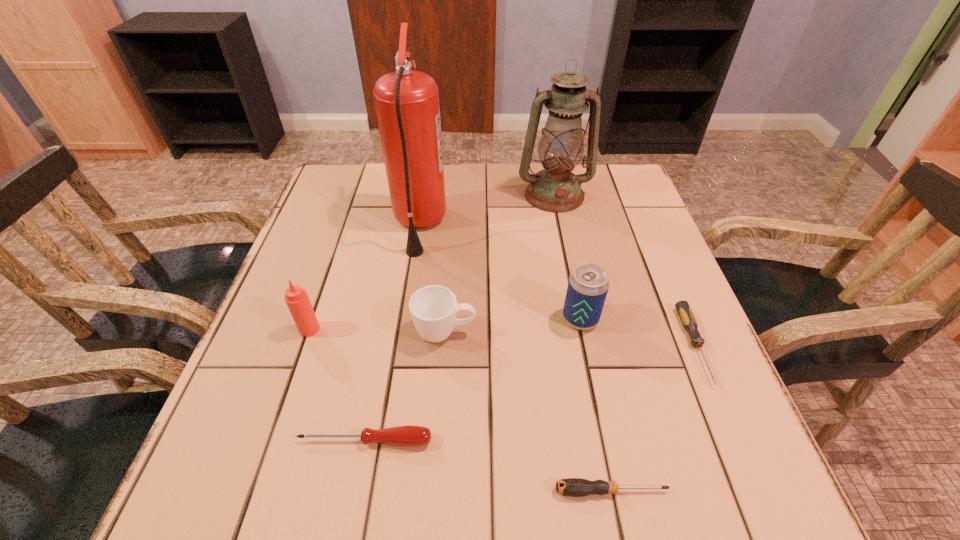
In order to click on oil lamp located in the far edge section of the desktop in this screenshot , I will do `click(555, 189)`.

Where is `object at the near edge`? The height and width of the screenshot is (540, 960). object at the near edge is located at coordinates (574, 487).

Where is `Tabasco sauce that is at the left edge`? The width and height of the screenshot is (960, 540). Tabasco sauce that is at the left edge is located at coordinates click(296, 298).

You are a GUI agent. You are given a task and a screenshot of the screen. Output one action in this format:
    pyautogui.click(x=<x>, y=<y>)
    Task: Click on the screwdriver that is at the left edge
    The width and height of the screenshot is (960, 540).
    Given the screenshot: What is the action you would take?
    pyautogui.click(x=410, y=435)

I want to click on oil lamp located in the right edge section of the desktop, so click(555, 189).

What are the coordinates of `object at the far right corner` in the screenshot? It's located at (555, 189).

Find the location of a particular element. The height and width of the screenshot is (540, 960). object at the near right corner is located at coordinates (574, 487).

The width and height of the screenshot is (960, 540). In the image, there is a desktop. What are the coordinates of `free space at the far edge` in the screenshot? It's located at (462, 211).

Locate an element on the screen. The width and height of the screenshot is (960, 540). free space at the near edge of the desktop is located at coordinates (440, 465).

Identify the location of vacant area at the left edge. The width and height of the screenshot is (960, 540). (311, 419).